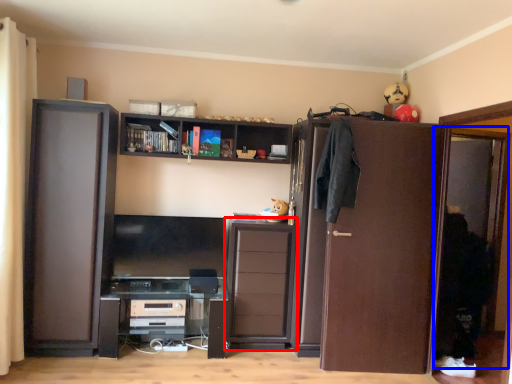
Question: Which object is closer to the camera taking this photo, cabinetry (highlighted by a red box) or screen door (highlighted by a blue box)?

Choices:
 (A) cabinetry
 (B) screen door

Answer: (B)